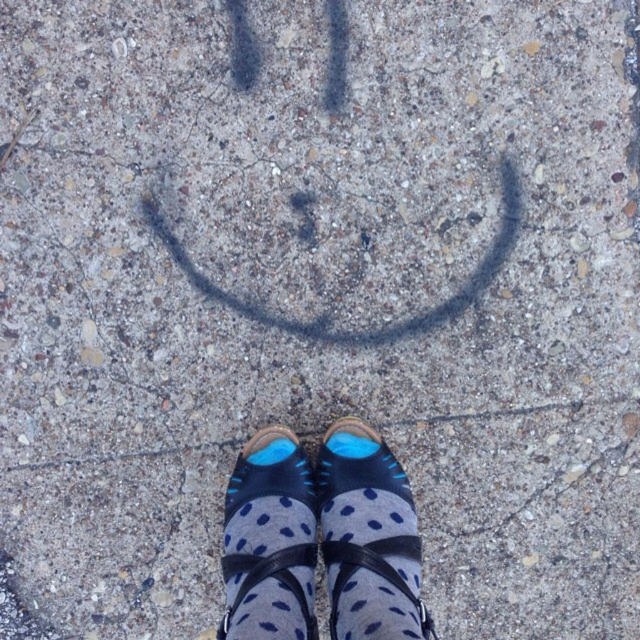
You are standing on the concrete surface with the smiley face and notice two items at the center. Which one is taller between the blue fabric socks at center and the blue suede shoe at center?

The blue fabric socks at center is taller than the blue suede shoe at center.

Based on the photo, you are standing in front of a concrete surface with a smiley face drawn on it. You see two items at the center of the image, the blue fabric socks at center and the blue suede shoe at center. Which one is closer to you?

The blue fabric socks at center is closer to the viewer than the blue suede shoe at center.

You are standing on the concrete surface with the smiley face and notice two items at the center. Which one is positioned to the right of the other? The items are the blue fabric socks at center and the blue suede shoe at center.

The blue fabric socks at center are positioned to the right of the blue suede shoe at center.